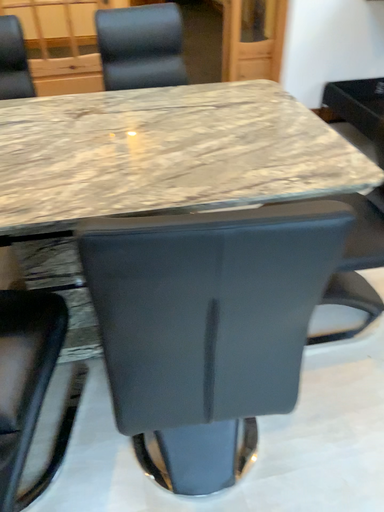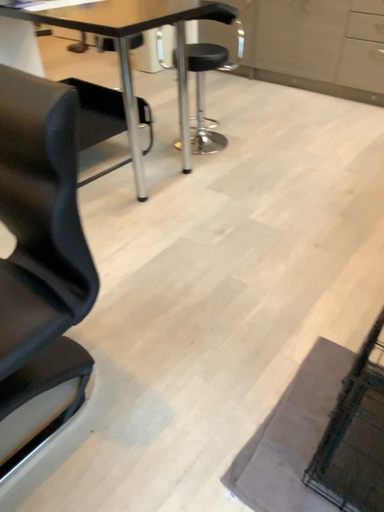
Question: Which way did the camera rotate in the video?

Choices:
 (A) rotated left
 (B) rotated right

Answer: (B)